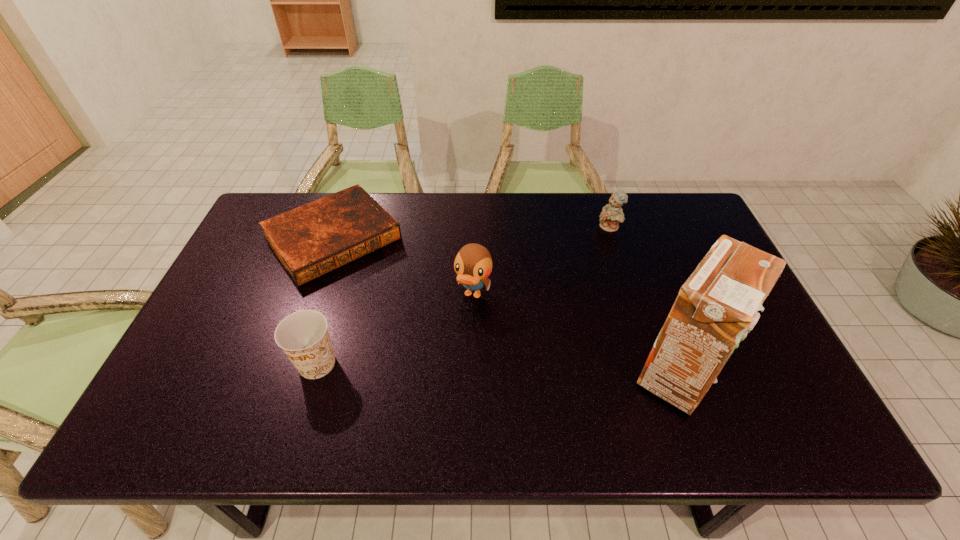
You are a GUI agent. You are given a task and a screenshot of the screen. Output one action in this format:
    pyautogui.click(x=<x>, y=<y>)
    Task: Click on the carton situated at the near edge
    Image resolution: width=960 pixels, height=540 pixels.
    Given the screenshot: What is the action you would take?
    pyautogui.click(x=718, y=303)

Locate an element on the screen. This screenshot has height=540, width=960. object positioned at the left edge is located at coordinates (316, 238).

The image size is (960, 540). I want to click on object situated at the right edge, so tap(718, 303).

Where is `object that is at the far left corner`? object that is at the far left corner is located at coordinates (316, 238).

Identify the location of object that is at the near right corner. (718, 303).

Locate an element on the screen. Image resolution: width=960 pixels, height=540 pixels. free space at the far edge is located at coordinates (499, 214).

In the image, there is a desktop. Identify the location of vacant area at the near edge. The width and height of the screenshot is (960, 540). (253, 389).

The height and width of the screenshot is (540, 960). What are the coordinates of `vacant space at the left edge of the desktop` in the screenshot? It's located at (245, 245).

Where is `vacant space at the far right corner of the desktop`? vacant space at the far right corner of the desktop is located at coordinates (702, 235).

Identify the location of free point between the second tallest object and the teddy bear. (541, 261).